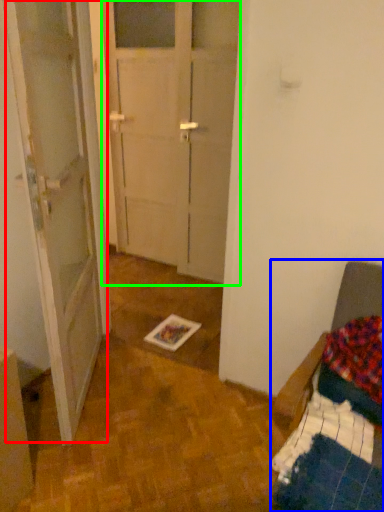
Question: Estimate the real-world distances between objects in this image. Which object is farther from barn door (highlighted by a red box), furniture (highlighted by a blue box) or glass door (highlighted by a green box)?

Choices:
 (A) furniture
 (B) glass door

Answer: (A)